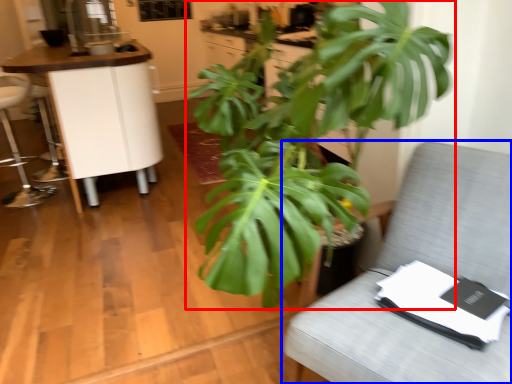
Question: Which point is closer to the camera, houseplant (highlighted by a red box) or furniture (highlighted by a blue box)?

Choices:
 (A) houseplant
 (B) furniture

Answer: (A)